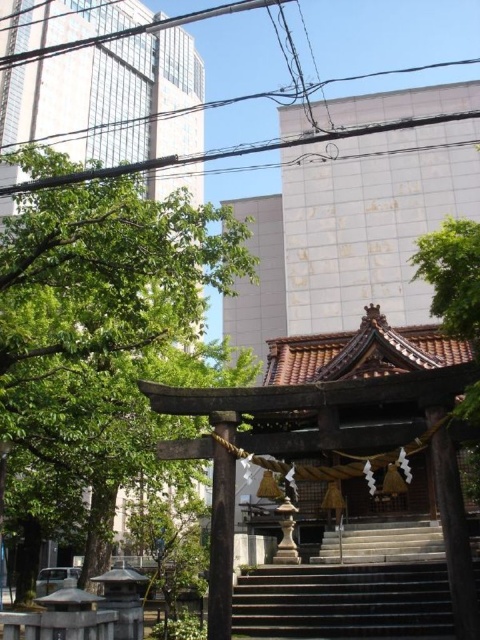
Which is more to the left, stone stairs at center or green leafy tree at upper right?

stone stairs at center is more to the left.

Can you confirm if stone stairs at center is taller than green leafy tree at upper right?

In fact, stone stairs at center may be shorter than green leafy tree at upper right.

Is point (377, 609) behind point (464, 330)?

Yes, point (377, 609) is behind point (464, 330).

This screenshot has height=640, width=480. What are the coordinates of `stone stairs at center` in the screenshot? It's located at pos(352,588).

The image size is (480, 640). Describe the element at coordinates (109, 99) in the screenshot. I see `green leafy tree at upper left` at that location.

Measure the distance between green leafy tree at upper left and green leafy tree at upper right.

green leafy tree at upper left is 276.89 feet away from green leafy tree at upper right.

The width and height of the screenshot is (480, 640). I want to click on green leafy tree at upper left, so click(x=109, y=99).

Identify the location of green leafy tree at upper left. This screenshot has height=640, width=480. 109,99.

Does point (63, 113) come farther from viewer compared to point (267, 595)?

Yes, point (63, 113) is farther from viewer.

Is green leafy tree at upper left taller than stone stairs at center?

Yes, green leafy tree at upper left is taller than stone stairs at center.

Who is more forward, (144, 67) or (379, 541)?

Point (379, 541)

Find the location of a particular element. The image size is (480, 640). green leafy tree at upper left is located at coordinates (109, 99).